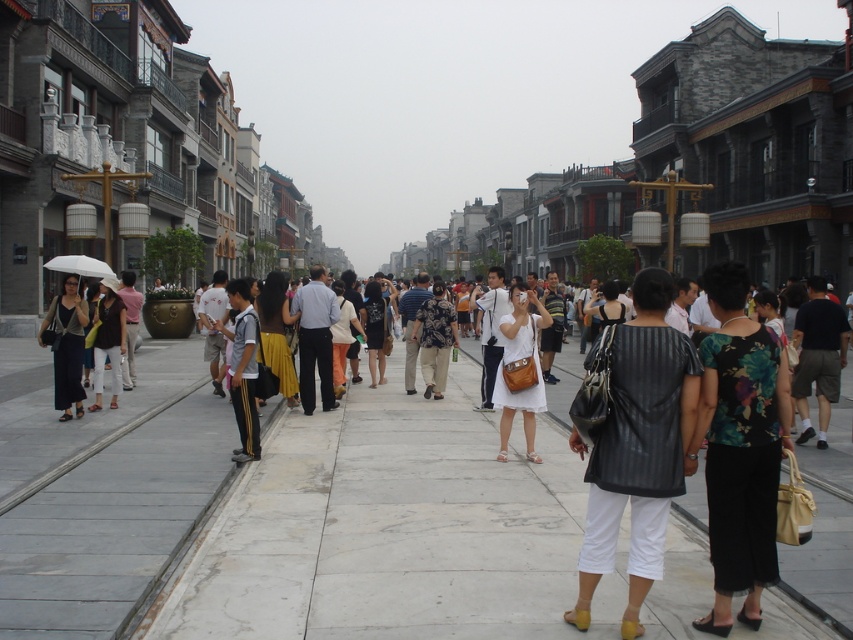
You are a photographer planning to capture a photo of the black leather vest at center and the floral fabric dress at center in the bustling street scene. Since you want both subjects to appear proportionally sized in the frame, which subject should you move closer to and which should you move farther away from the camera?

Since the black leather vest at center has a lesser width compared to the floral fabric dress at center, to make them appear proportionally sized in the photo, you should move the camera closer to the black leather vest at center and farther from the floral fabric dress at center. This adjustment will enlarge the smaller vest and shrink the wider dress in the frame, balancing their sizes.

You are standing at the center of the street and want to find the dark gray shorts at right. According to the coordinates provided, in which direction should you look to locate it?

The dark gray shorts at right is located at coordinates point [817,356], which means you should look to your right side since the x coordinate 0.558 is to the right of the center and the y coordinate 0.959 is near the bottom of the image.